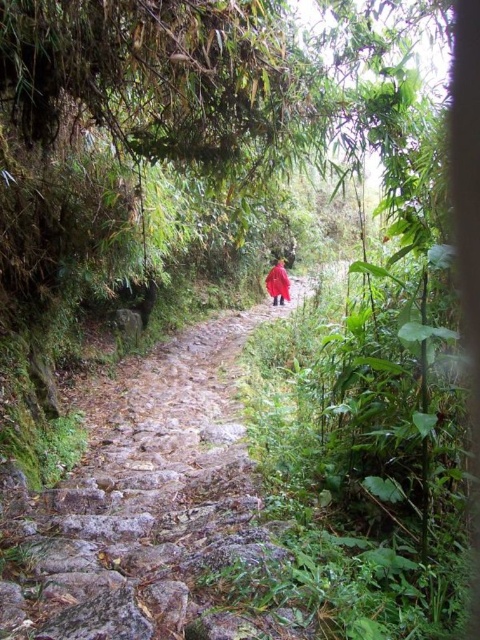
Question: Observing the image, what is the correct spatial positioning of rustic stone steps at center in reference to red matte jacket at center?

Choices:
 (A) left
 (B) right

Answer: (A)

Question: Does rustic stone steps at center lie in front of red matte jacket at center?

Choices:
 (A) no
 (B) yes

Answer: (B)

Question: Which of the following is the farthest from the observer?

Choices:
 (A) rustic stone steps at center
 (B) red matte jacket at center

Answer: (B)

Question: Which point appears farthest from the camera in this image?

Choices:
 (A) (287, 285)
 (B) (54, 544)

Answer: (A)

Question: Does rustic stone steps at center appear on the left side of red matte jacket at center?

Choices:
 (A) yes
 (B) no

Answer: (A)